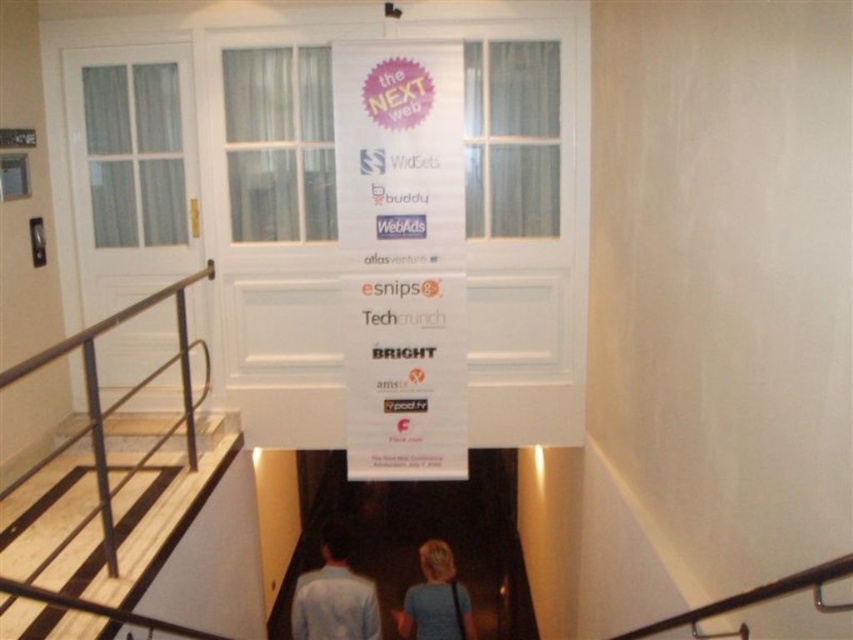
You are a photographer standing at the top of the staircase in the image. You want to take a photo of the white door at the bottom with the banner. However, there is a person wearing a light blue shirt at center and an object metallic at upper right in your way. Which object should you move to get a clear shot of the door?

You should move the metallic at upper right because it is behind the light blue shirt at center, so moving the light blue shirt at center would still leave the metallic at upper right blocking the view.